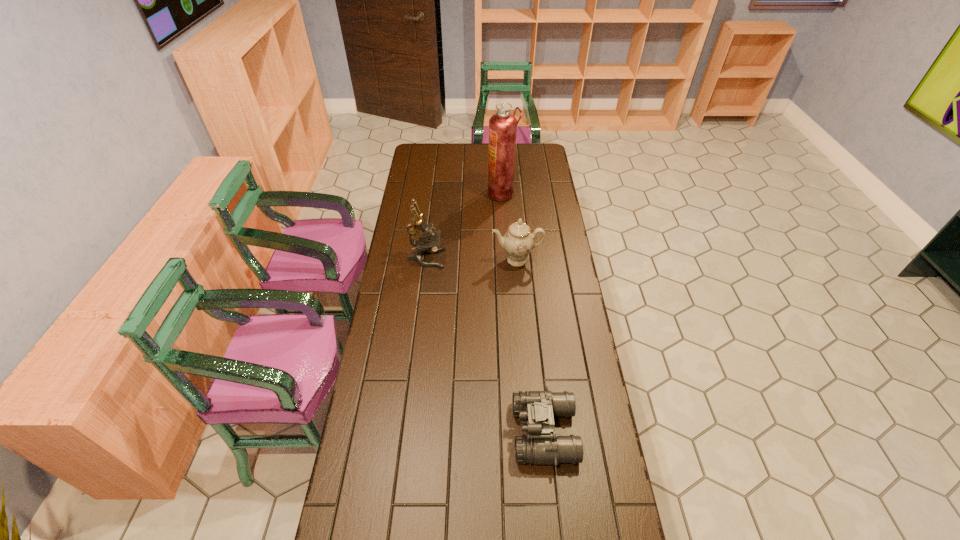
Where is `vacant space situated 0.360m at the eyepieces of the microscope`? The width and height of the screenshot is (960, 540). vacant space situated 0.360m at the eyepieces of the microscope is located at coordinates (529, 259).

Locate an element on the screen. The image size is (960, 540). free space located on the spout of the chinaware is located at coordinates (519, 294).

Identify the location of blank area located 0.050m through the lenses of the binoculars. Image resolution: width=960 pixels, height=540 pixels. (497, 432).

The width and height of the screenshot is (960, 540). In order to click on free space located 0.070m through the lenses of the binoculars in this screenshot , I will do `click(491, 432)`.

Identify the location of blank space located 0.230m through the lenses of the binoculars. This screenshot has width=960, height=540. (439, 432).

The image size is (960, 540). What are the coordinates of `object located in the left edge section of the desktop` in the screenshot? It's located at (427, 242).

Where is `chinaware that is at the right edge`? The width and height of the screenshot is (960, 540). chinaware that is at the right edge is located at coordinates (518, 241).

In order to click on binoculars located at the right edge in this screenshot , I will do `click(536, 410)`.

Where is `vacant space at the left edge of the desktop`? Image resolution: width=960 pixels, height=540 pixels. vacant space at the left edge of the desktop is located at coordinates (397, 258).

In the image, there is a desktop. Where is `vacant space at the right edge`? This screenshot has width=960, height=540. vacant space at the right edge is located at coordinates (526, 171).